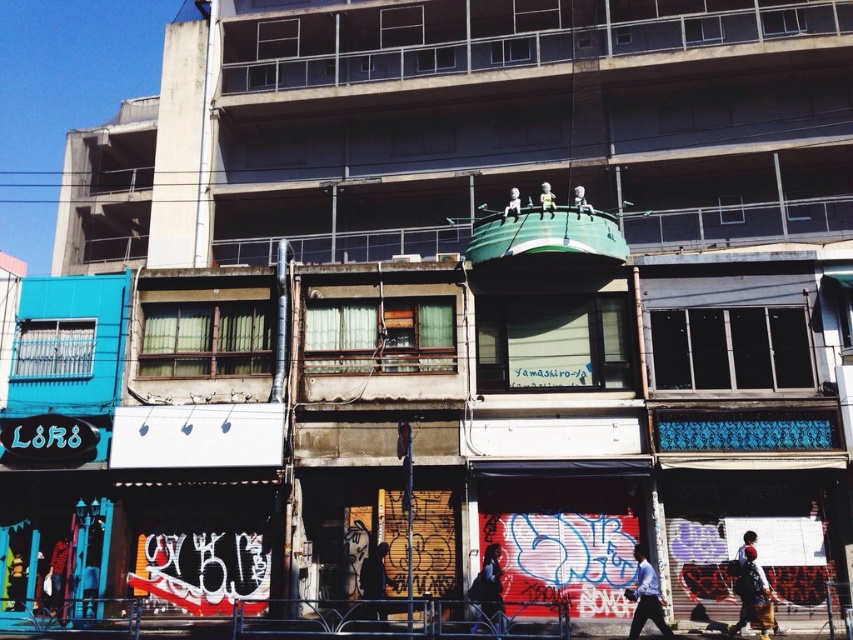
Question: Which of the following is the closest to the observer?

Choices:
 (A) metallic astronaut at upper center
 (B) metallic statue at upper center
 (C) white cotton shirt at lower right

Answer: (C)

Question: Can you confirm if white cotton shirt at lower right is positioned to the left of smooth white statue at upper center?

Choices:
 (A) yes
 (B) no

Answer: (B)

Question: Which point appears closest to the camera in this image?

Choices:
 (A) (546, 186)
 (B) (582, 202)
 (C) (512, 189)

Answer: (B)

Question: Among these objects, which one is farthest from the camera?

Choices:
 (A) dark blue jeans at center
 (B) metallic astronaut at upper center
 (C) dark clothing figure at lower center
 (D) metallic statue at upper center

Answer: (B)

Question: Does light blue shirt at lower right appear on the left side of metallic astronaut at upper center?

Choices:
 (A) yes
 (B) no

Answer: (A)

Question: Can you confirm if white cotton shirt at lower right is bigger than smooth white statue at upper center?

Choices:
 (A) no
 (B) yes

Answer: (A)